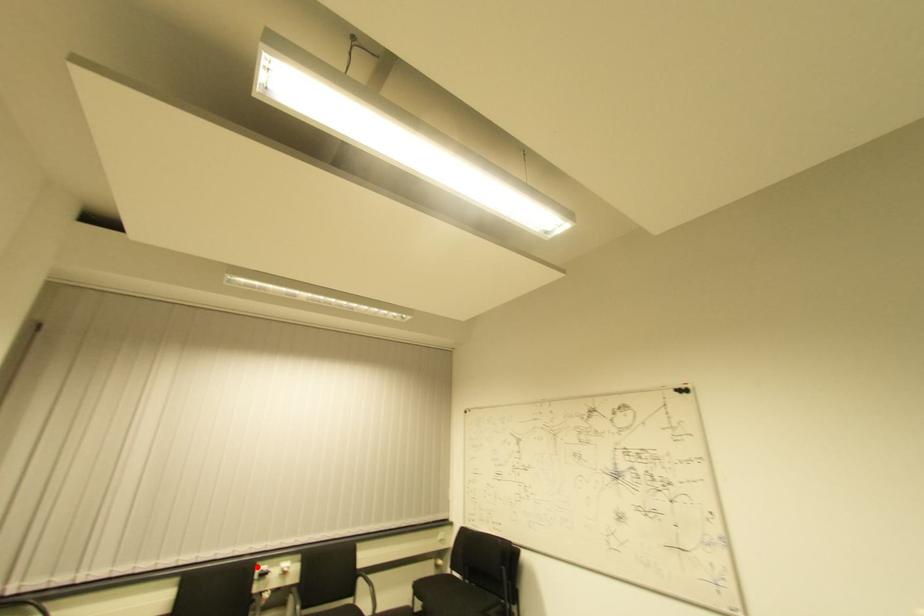
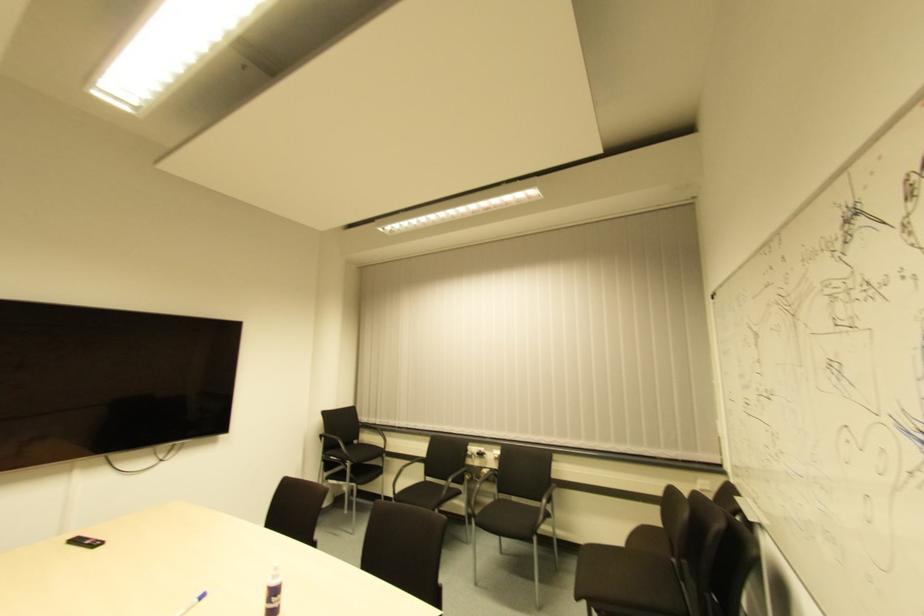
In the second image, find the point that corresponds to the highlighted location in the first image.

(468, 447)